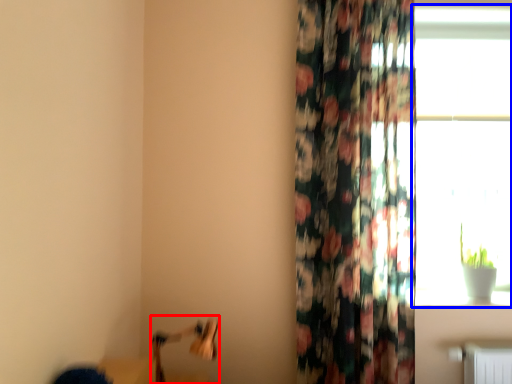
Question: Which point is closer to the camera, swivel chair (highlighted by a red box) or window (highlighted by a blue box)?

Choices:
 (A) swivel chair
 (B) window

Answer: (A)